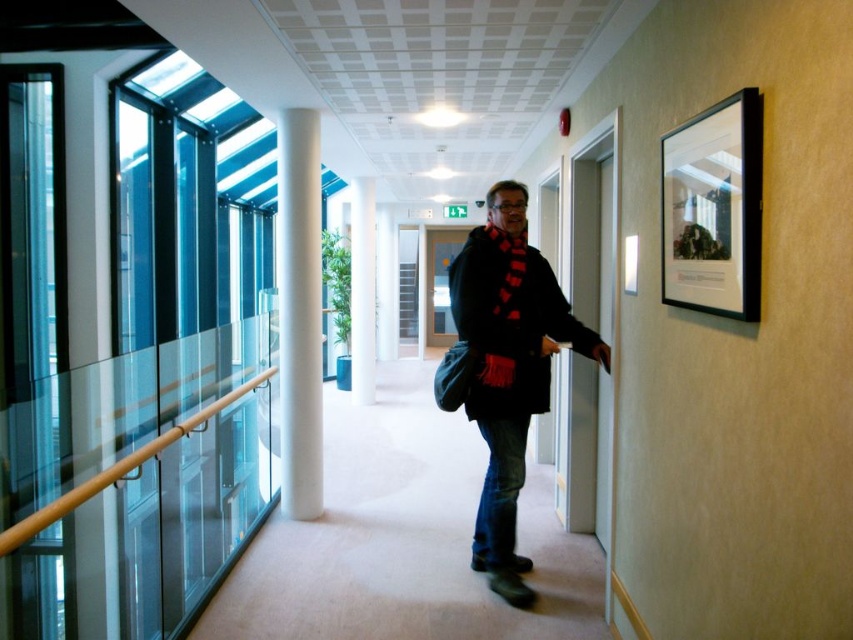
Question: Considering the relative positions of white smooth column at center and white glossy pillar at center in the image provided, where is white smooth column at center located with respect to white glossy pillar at center?

Choices:
 (A) above
 (B) below

Answer: (B)

Question: Which of the following is the closest to the observer?

Choices:
 (A) (445, 400)
 (B) (364, 285)

Answer: (A)

Question: Is black matte coat at center above white glossy pillar at center?

Choices:
 (A) yes
 (B) no

Answer: (B)

Question: Which of the following is the closest to the observer?

Choices:
 (A) click(x=370, y=188)
 (B) click(x=509, y=314)

Answer: (B)

Question: Can you confirm if black matte coat at center is thinner than white glossy pillar at center?

Choices:
 (A) no
 (B) yes

Answer: (A)

Question: Which of the following is the farthest from the observer?

Choices:
 (A) (299, 202)
 (B) (349, 220)

Answer: (B)